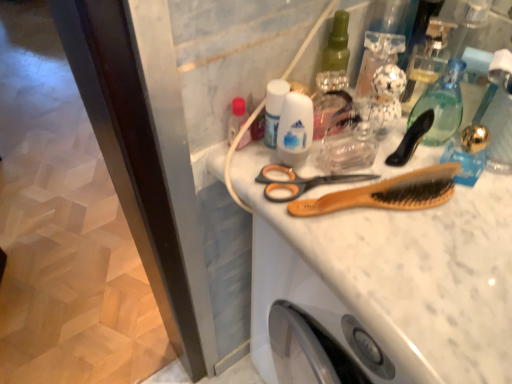
Question: Can you confirm if translucent glass mouthwash at upper right, the 2th mouthwash when ordered from left to right, is positioned to the right of matte plastic bottle at upper left, marked as the second toiletry in a right-to-left arrangement?

Choices:
 (A) no
 (B) yes

Answer: (B)

Question: Is translucent glass mouthwash at upper right, the 2th mouthwash when ordered from left to right, to the left of matte plastic bottle at upper left, marked as the second toiletry in a right-to-left arrangement, from the viewer's perspective?

Choices:
 (A) yes
 (B) no

Answer: (B)

Question: Is matte plastic bottle at upper left, marked as the second toiletry in a right-to-left arrangement, a part of translucent glass mouthwash at upper right, the 2th mouthwash when ordered from left to right?

Choices:
 (A) yes
 (B) no

Answer: (B)

Question: Could you tell me if translucent glass mouthwash at upper right, the 2th mouthwash when ordered from left to right, is turned towards matte plastic bottle at upper left, the first toiletry viewed from the left?

Choices:
 (A) yes
 (B) no

Answer: (B)

Question: Is translucent glass mouthwash at upper right, the first mouthwash in the right-to-left sequence, smaller than matte plastic bottle at upper left, marked as the second toiletry in a right-to-left arrangement?

Choices:
 (A) no
 (B) yes

Answer: (A)

Question: Is wooden comb at center wider or thinner than black plastic brush at upper right?

Choices:
 (A) thin
 (B) wide

Answer: (B)

Question: Visually, is wooden comb at center positioned to the left or to the right of black plastic brush at upper right?

Choices:
 (A) left
 (B) right

Answer: (A)

Question: Is wooden comb at center inside the boundaries of black plastic brush at upper right, or outside?

Choices:
 (A) outside
 (B) inside

Answer: (A)

Question: Considering the positions of point (294, 208) and point (417, 127), is point (294, 208) closer or farther from the camera than point (417, 127)?

Choices:
 (A) closer
 (B) farther

Answer: (A)

Question: From their relative heights in the image, would you say black plastic brush at upper right is taller or shorter than white glossy mouthwash at center, which appears as the 1th mouthwash when viewed from the left?

Choices:
 (A) tall
 (B) short

Answer: (B)

Question: Which is correct: black plastic brush at upper right is inside white glossy mouthwash at center, which appears as the 1th mouthwash when viewed from the left, or outside of it?

Choices:
 (A) inside
 (B) outside

Answer: (B)

Question: From a real-world perspective, is black plastic brush at upper right positioned above or below white glossy mouthwash at center, which appears as the 2th mouthwash when viewed from the right?

Choices:
 (A) above
 (B) below

Answer: (B)

Question: Considering the positions of black plastic brush at upper right and white glossy mouthwash at center, which appears as the 2th mouthwash when viewed from the right, in the image, is black plastic brush at upper right wider or thinner than white glossy mouthwash at center, which appears as the 2th mouthwash when viewed from the right,?

Choices:
 (A) wide
 (B) thin

Answer: (B)

Question: Do you think translucent glass mouthwash at upper right, the first mouthwash in the right-to-left sequence, is within white glossy mouthwash at center, which appears as the 1th mouthwash when viewed from the left, or outside of it?

Choices:
 (A) inside
 (B) outside

Answer: (B)

Question: Is translucent glass mouthwash at upper right, the first mouthwash in the right-to-left sequence, bigger or smaller than white glossy mouthwash at center, which appears as the 2th mouthwash when viewed from the right?

Choices:
 (A) big
 (B) small

Answer: (A)